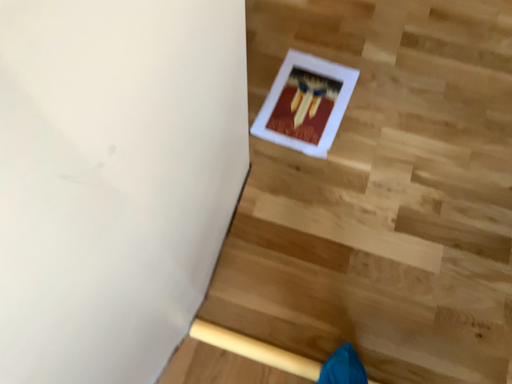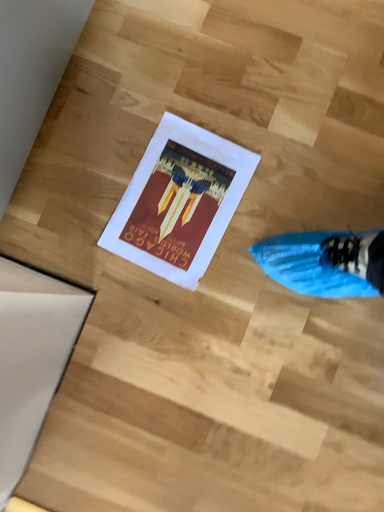
Question: How did the camera likely rotate when shooting the video?

Choices:
 (A) rotated upward
 (B) rotated downward

Answer: (B)